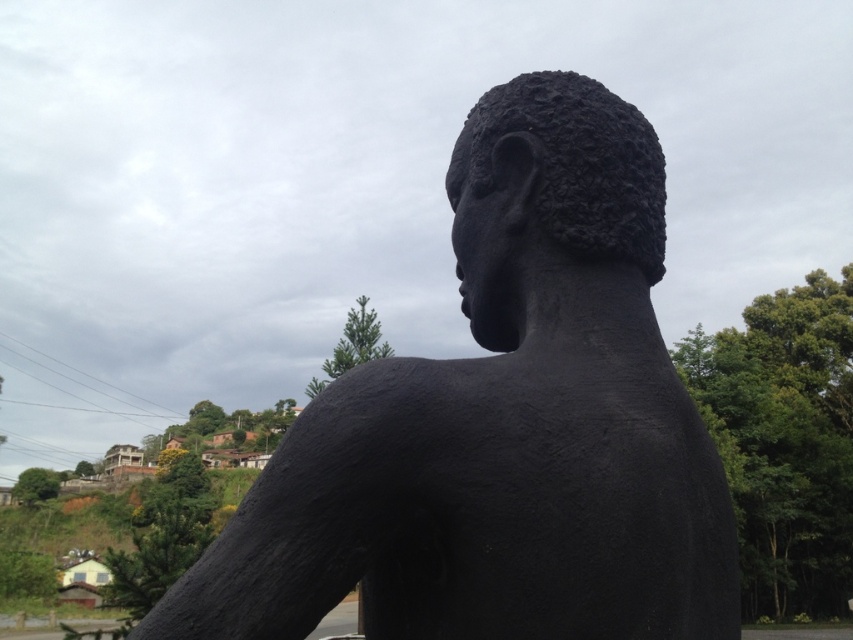
You are an art curator examining the sculpture. You notice the black matte bust at center and the black matte head at center. Which object is positioned lower in the image?

The black matte bust at center is positioned below the black matte head at center, so the bust is lower.

You are an art student analyzing the sculpture. You notice two parts labeled as the black matte bust at center and the black matte head at center. Which part is located to the left when viewed from the front?

The black matte bust at center is positioned on the left side of the black matte head at center, so the black matte bust at center is located to the left when viewed from the front.